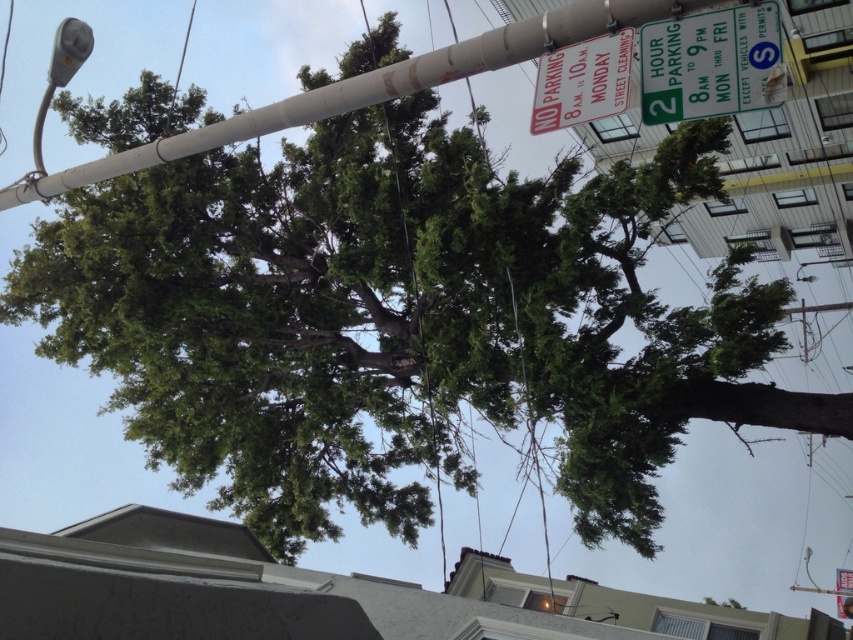
Question: Which object appears farthest from the camera in this image?

Choices:
 (A) white plastic sign at upper center
 (B) green plastic parking sign at upper right

Answer: (A)

Question: Among these objects, which one is nearest to the camera?

Choices:
 (A) smooth gray pole at upper center
 (B) white plastic sign at upper center
 (C) green plastic parking sign at upper right
 (D) metallic gray streetlight at upper left

Answer: (C)

Question: From the image, what is the correct spatial relationship of smooth gray pole at upper center in relation to white plastic sign at upper center?

Choices:
 (A) left
 (B) right

Answer: (A)

Question: Does green plastic parking sign at upper right appear on the left side of white plastic sign at upper center?

Choices:
 (A) no
 (B) yes

Answer: (A)

Question: Estimate the real-world distances between objects in this image. Which object is closer to the green plastic parking sign at upper right?

Choices:
 (A) metallic gray streetlight at upper left
 (B) smooth gray pole at upper center

Answer: (B)

Question: Can you confirm if green plastic parking sign at upper right is positioned above metallic gray streetlight at upper left?

Choices:
 (A) no
 (B) yes

Answer: (A)